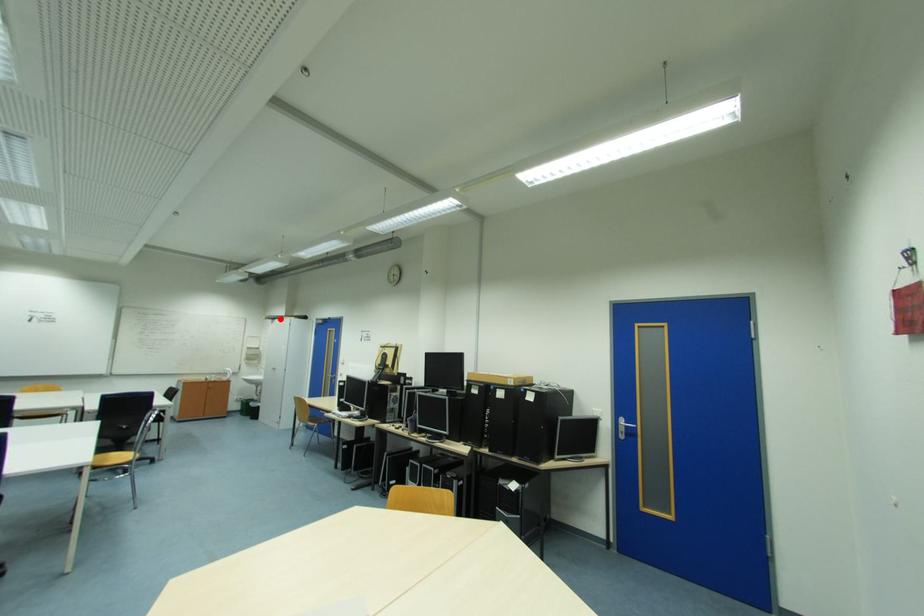
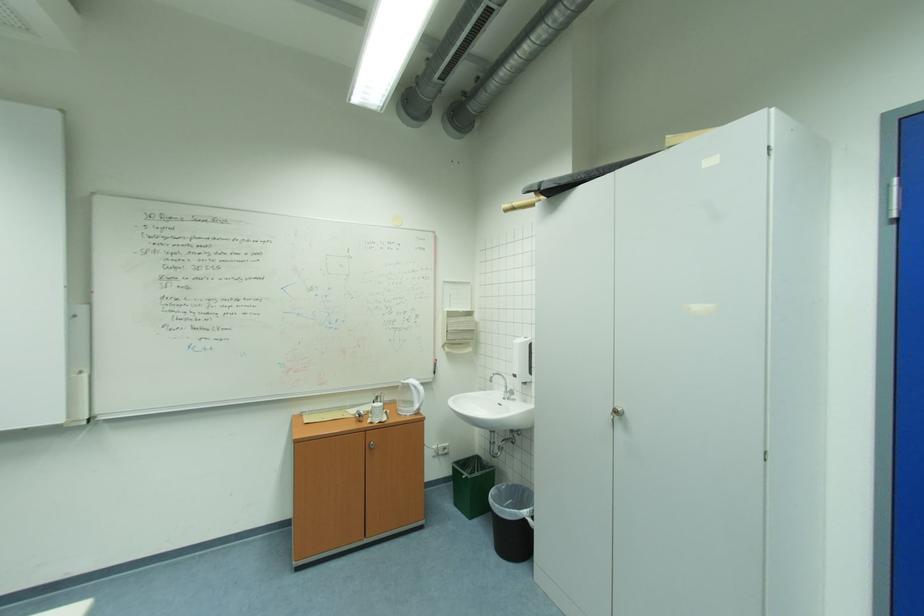
Locate, in the second image, the point that corresponds to the highlighted location in the first image.

(569, 182)